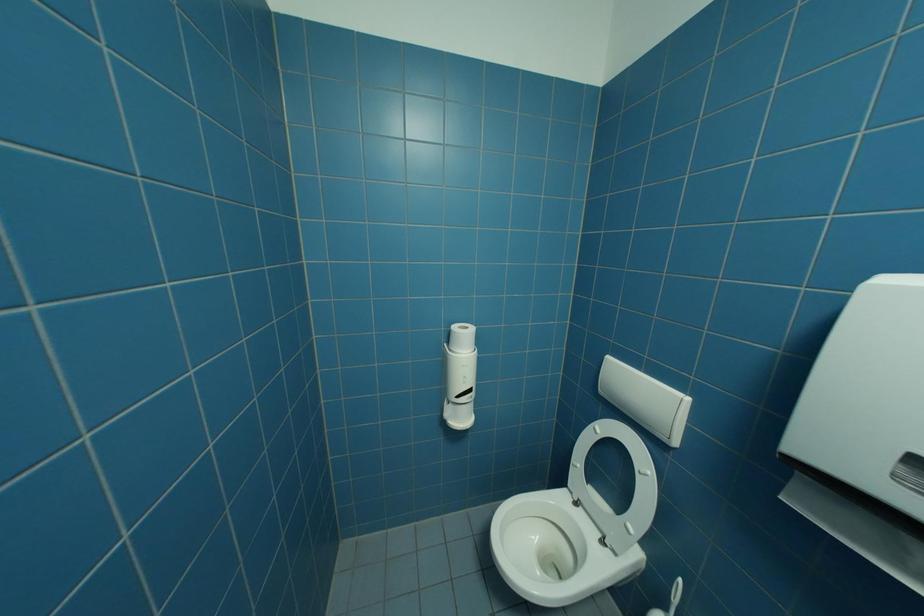
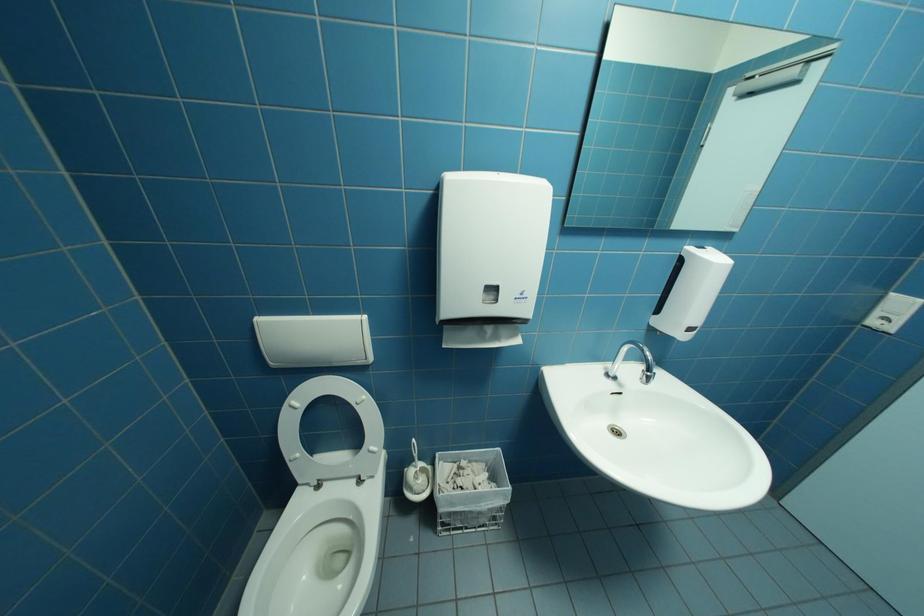
Based on the continuous images, in which direction is the camera rotating?

The camera's rotation is toward right-down.